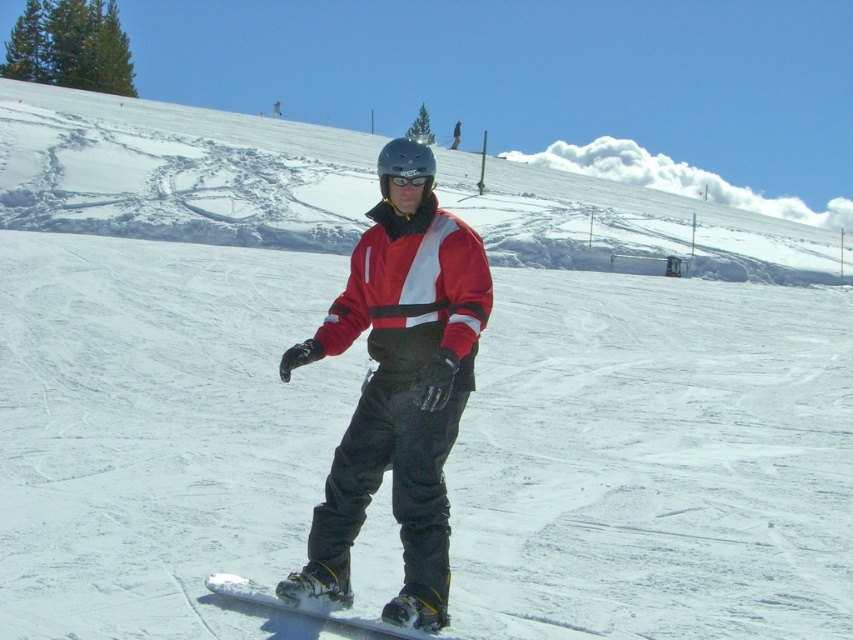
You are a photographer trying to capture the snowboarder and their board in a single shot. Based on the scene, can you tell if the matte red snowboarder at center is positioned closer to the camera than the white matte snowboard at center?

The matte red snowboarder at center is in front of the white matte snowboard at center, so yes, the snowboarder is closer to the camera than the snowboard.

You are a photographer trying to capture the matte red snowboarder at center and the transparent plastic goggles at center in a single shot. Since you want to emphasize the snowboarder, which object should you focus on to ensure it appears clearer in the photo?

The matte red snowboarder at center is larger in size than transparent plastic goggles at center, so focusing on the matte red snowboarder at center will ensure it appears clearer in the photo.